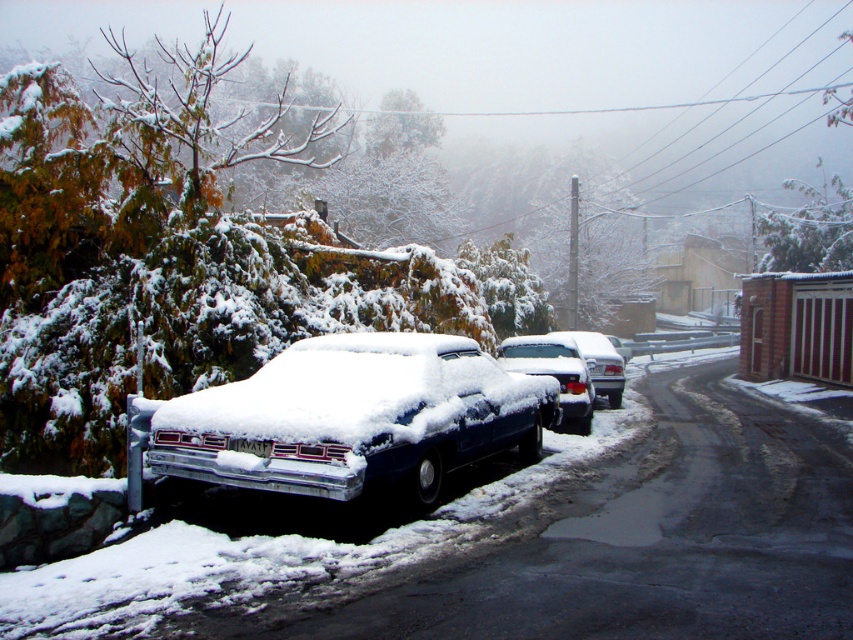
You are standing in the snowy urban street scene and want to walk from point A to point B. Point A is at coordinate point (x=598, y=349) and point B is at coordinate point (x=256, y=445). Which point is closer to you as you start walking?

Point B at coordinate point (x=256, y=445) is closer to you because it is less further to the camera than point A at coordinate point (x=598, y=349).